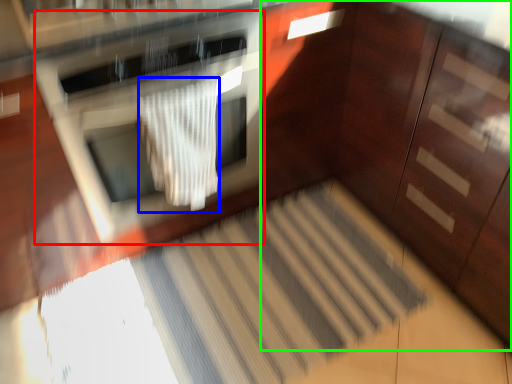
Question: Which object is positioned farthest from oven (highlighted by a red box)? Select from blanket (highlighted by a blue box) and dresser (highlighted by a green box).

Choices:
 (A) blanket
 (B) dresser

Answer: (B)